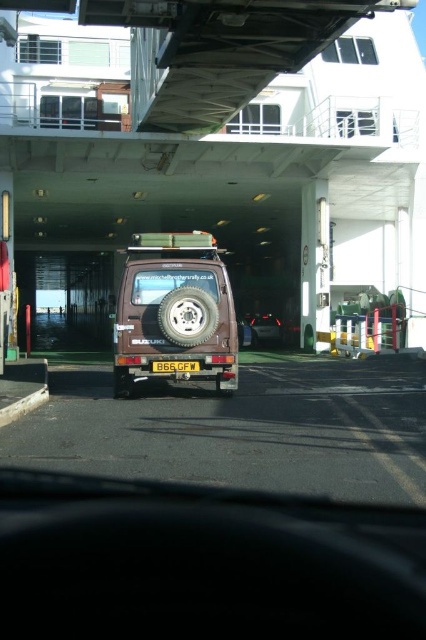
You are inside a vehicle on a ferry and want to know if you can safely move forward without hitting any obstacles. There are two points marked on your screen corresponding to coordinates point (x=127, y=387) and point (x=267, y=337). Which point is closer to your vehicle?

Point (x=127, y=387) is closer to the camera than point (x=267, y=337), so the point closer to your vehicle is point (x=127, y=387).

You are driving a car that is 4.5 meters long and want to park it in the ferry deck. The camera is at your current position. There is a point at coordinate (x=193, y=323). Can your car fit in the space between the camera and that point?

The distance between the camera and the point (x=193, y=323) is 9.71 meters. Since your car is 4.5 meters long, there is enough space to park it in that area.

You are driving a car on the ferry and need to park behind the brown matte jeep at center and the matte brown van at center. Which one should you park behind to ensure your vehicle is closer to the ferry railings?

The matte brown van at center is closer to the ferry railings because the brown matte jeep at center is located above it, meaning it is positioned further back from the railings.